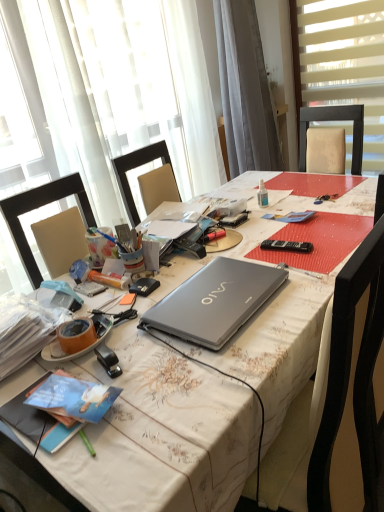
Question: From a real-world perspective, is gray fabric curtain at upper center above or below clear plastic bottle at center?

Choices:
 (A) above
 (B) below

Answer: (A)

Question: Is gray fabric curtain at upper center inside or outside of clear plastic bottle at center?

Choices:
 (A) outside
 (B) inside

Answer: (A)

Question: Which of these objects is positioned closest to the black plastic remote control at center?

Choices:
 (A) silver metallic laptop at center
 (B) translucent fabric at upper left, placed as the 1th window when sorted from left to right
 (C) gray fabric curtain at upper center
 (D) clear plastic bottle at center
 (E) black plastic remote control at center

Answer: (E)

Question: Estimate the real-world distances between objects in this image. Which object is closer to the blue matte book at lower left, which ranks as the first book in bottom-to-top order?

Choices:
 (A) black plastic remote control at center
 (B) blue paperback book at lower left, the 2th book positioned from the bottom
 (C) silver metallic laptop at center
 (D) matte plastic pencil at center-left
 (E) black plastic stapler at lower left

Answer: (B)